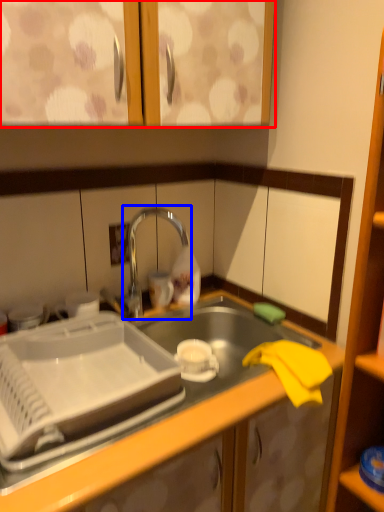
Question: Which of the following is the closest to the observer, cabinetry (highlighted by a red box) or tap (highlighted by a blue box)?

Choices:
 (A) cabinetry
 (B) tap

Answer: (A)